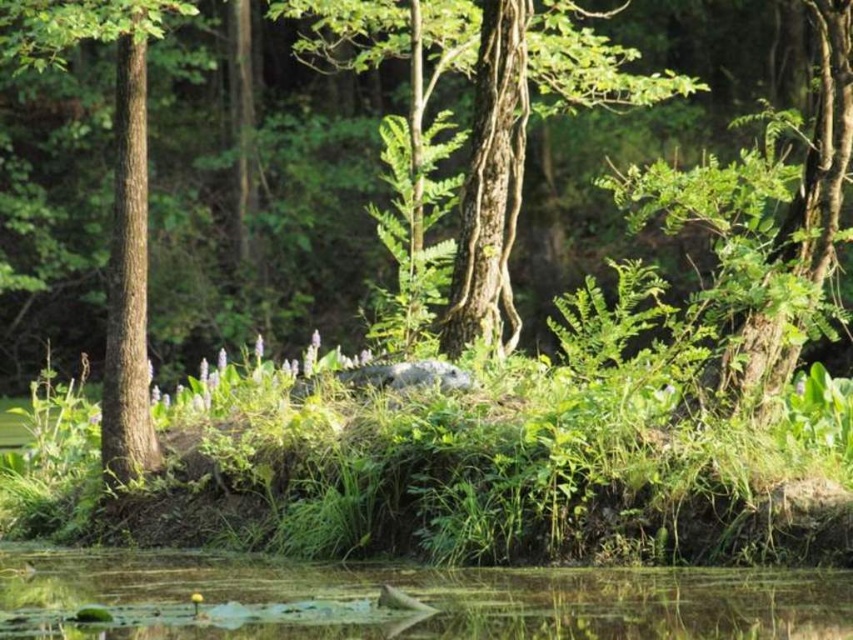
Which is above, greenish murky water at lower center or brown rough bark tree at left?

brown rough bark tree at left

Image resolution: width=853 pixels, height=640 pixels. What do you see at coordinates (408, 595) in the screenshot?
I see `greenish murky water at lower center` at bounding box center [408, 595].

Locate an element on the screen. greenish murky water at lower center is located at coordinates (408, 595).

Identify the location of greenish murky water at lower center. (408, 595).